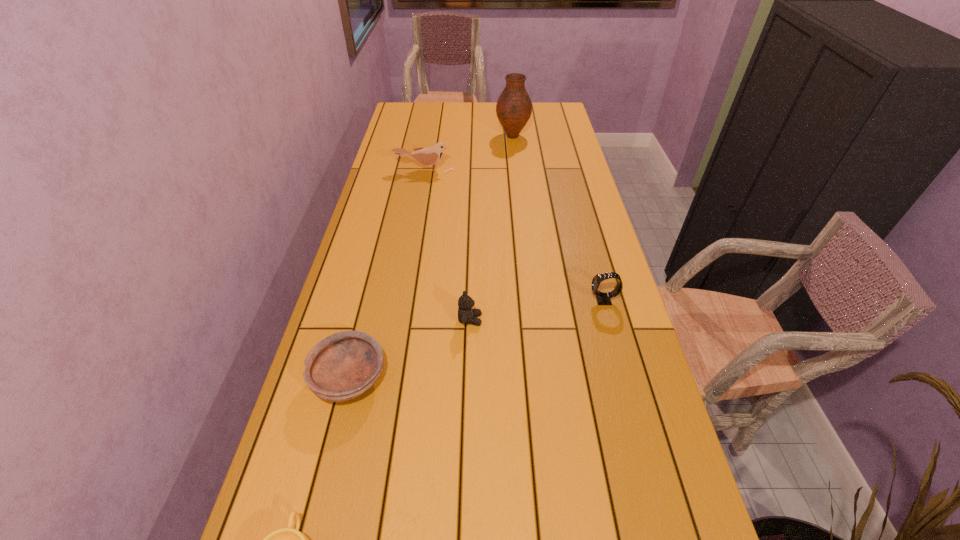
Identify the location of vacant region at the far edge of the desktop. This screenshot has width=960, height=540. (451, 105).

Identify the location of blank space at the left edge of the desktop. This screenshot has width=960, height=540. (302, 477).

Find the location of a particular element. blank space at the right edge is located at coordinates (559, 254).

The height and width of the screenshot is (540, 960). I want to click on vacant space at the far left corner of the desktop, so click(405, 102).

Locate an element on the screen. The height and width of the screenshot is (540, 960). vacant area that lies between the watch and the teddy bear is located at coordinates (537, 310).

This screenshot has height=540, width=960. I want to click on free space between the fifth nearest object and the rightmost object, so click(x=514, y=235).

I want to click on free space between the fifth object from left to right and the teddy bear, so click(492, 228).

Where is `blank region between the fifth object from left to right and the fifth shortest object`? Image resolution: width=960 pixels, height=540 pixels. blank region between the fifth object from left to right and the fifth shortest object is located at coordinates (468, 153).

At what (x,y) coordinates should I click in order to perform the action: click on blank region between the teddy bear and the second nearest object. Please return your answer as a coordinate pair (x, y). Looking at the image, I should click on (410, 349).

Locate an element on the screen. This screenshot has height=540, width=960. vacant area that lies between the fifth farthest object and the second tallest object is located at coordinates (387, 274).